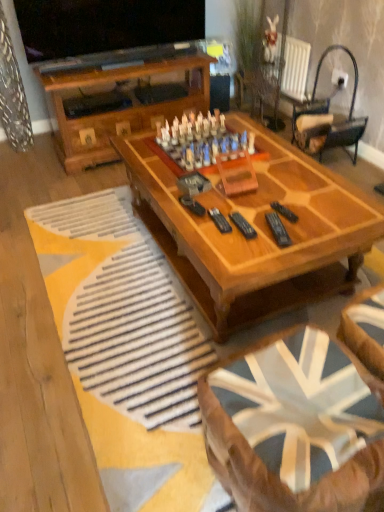
What are the coordinates of `vacant area located to the right-hand side of wooden chess set at center` in the screenshot? It's located at (284, 161).